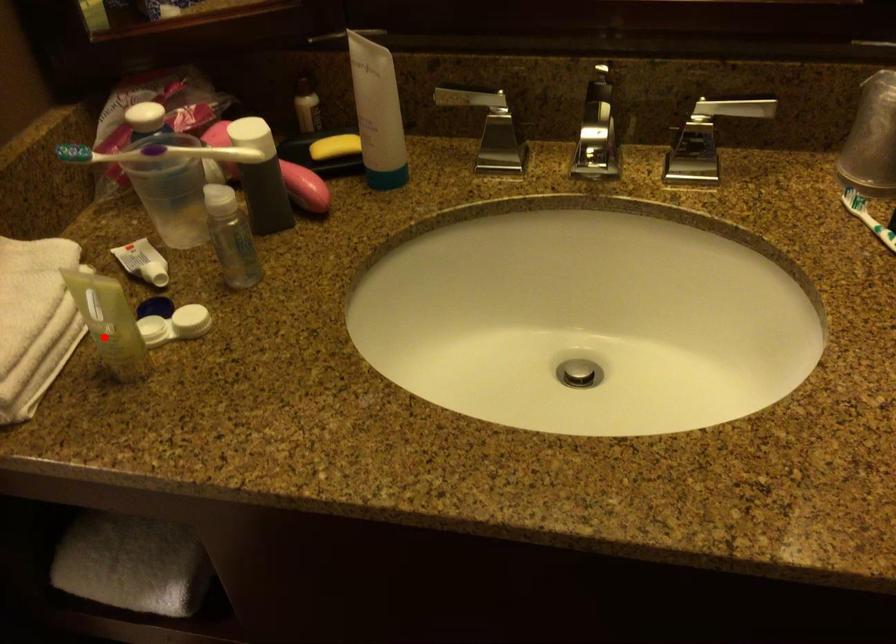
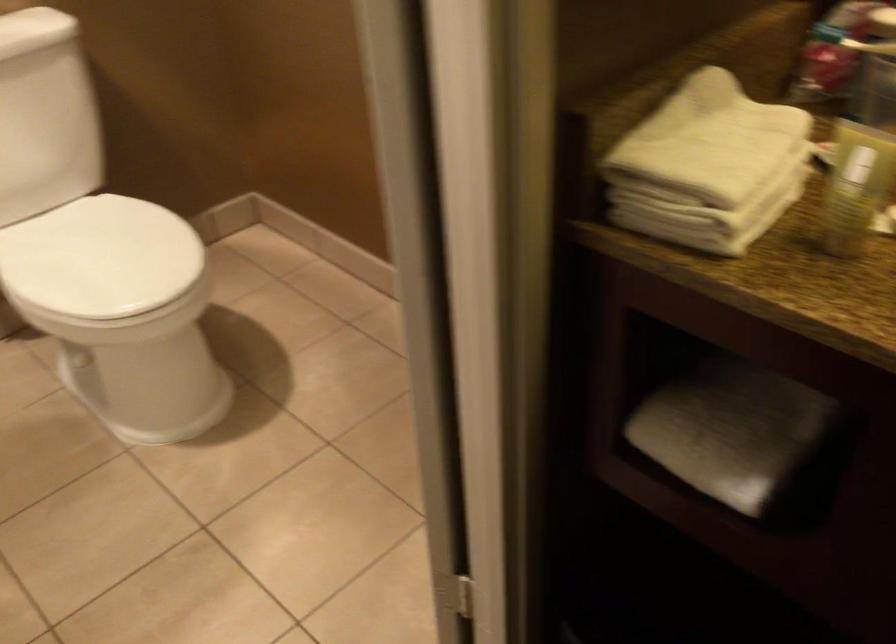
Where in the second image is the point corresponding to the highlighted location from the first image?

(849, 204)